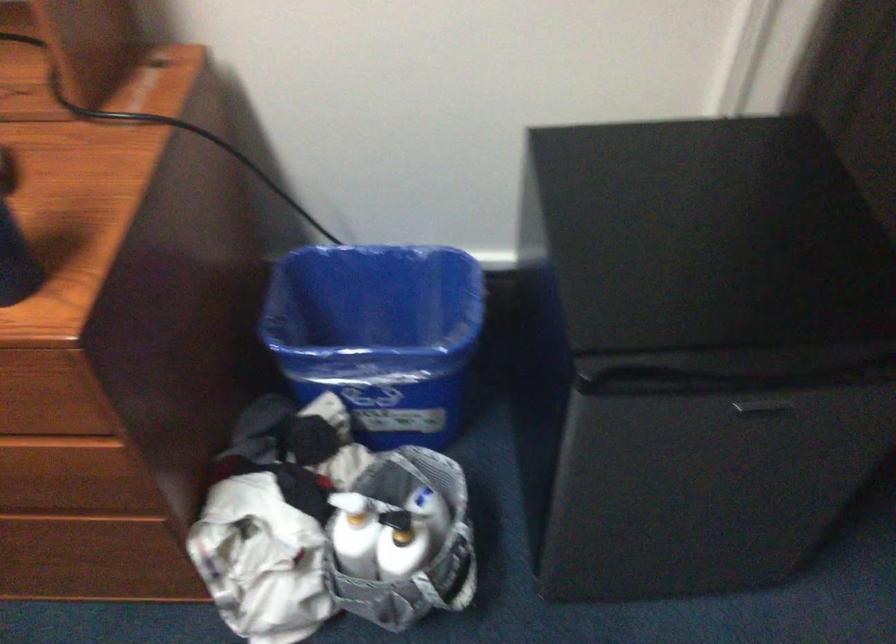
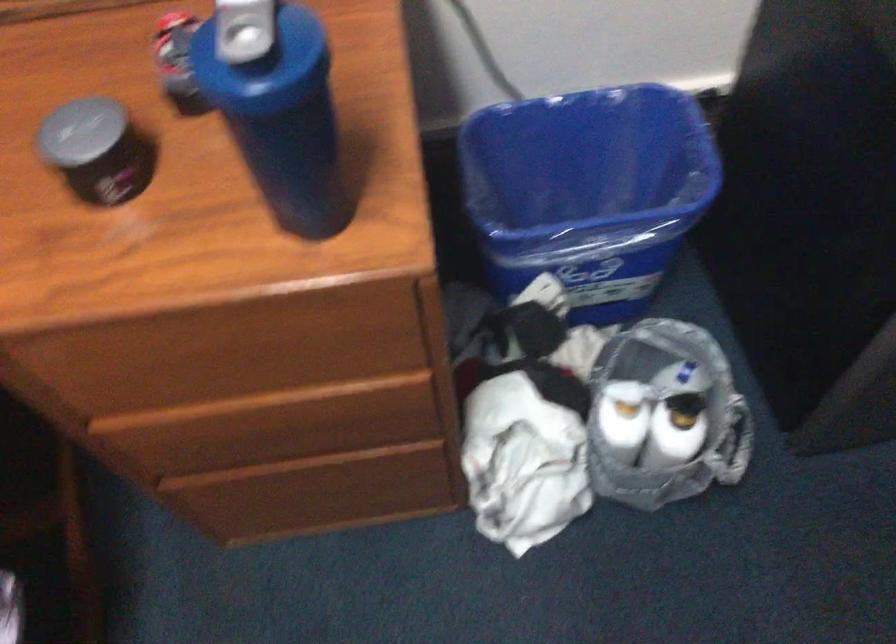
What movement of the cameraman would produce the second image?

The cameraman walked toward left, forward.